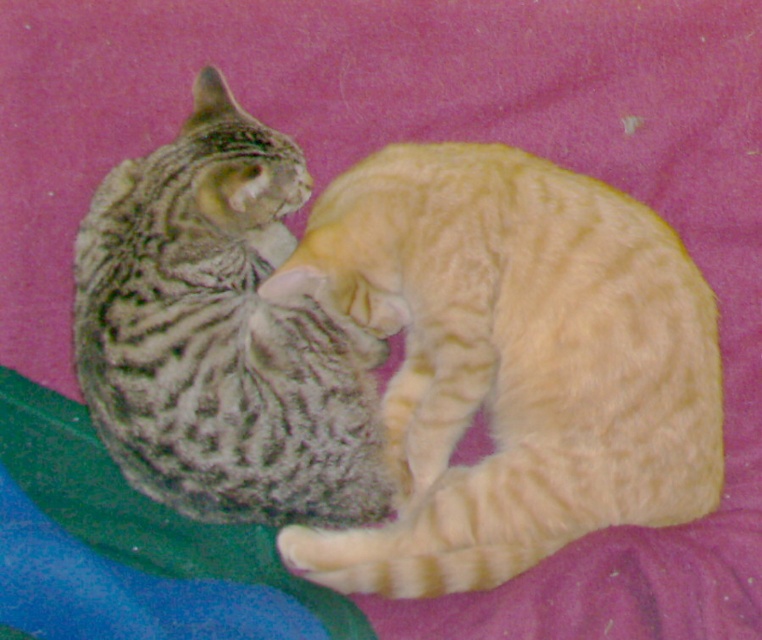
Describe the element at coordinates (511, 362) in the screenshot. I see `orange tabby cat at center` at that location.

Which is above, orange tabby cat at center or gray striped cat at left?

gray striped cat at left is higher up.

Is point (500, 317) positioned after point (290, 147)?

No, (500, 317) is closer to viewer.

Where is `orange tabby cat at center`? orange tabby cat at center is located at coordinates (511, 362).